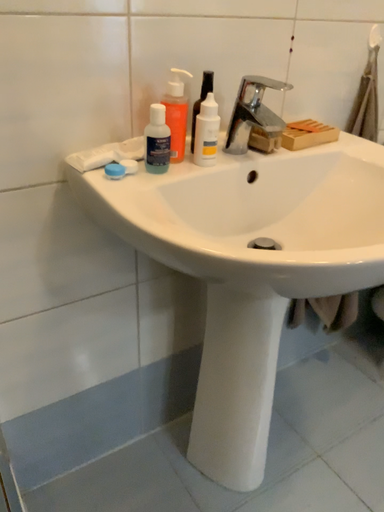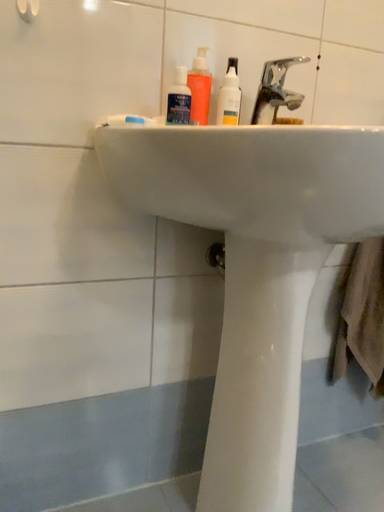
Question: Which way did the camera rotate in the video?

Choices:
 (A) rotated right
 (B) rotated left

Answer: (B)